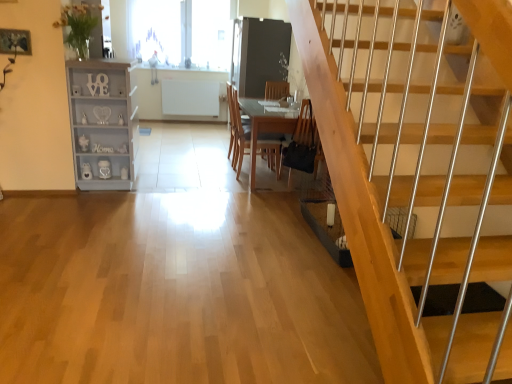
Question: From the image's perspective, is transparent glass window at upper center, the 1th window in the front-to-back sequence, on top of black leather chair at lower center?

Choices:
 (A) no
 (B) yes

Answer: (B)

Question: Does transparent glass window at upper center, which ranks as the second window in back-to-front order, have a smaller size compared to black leather chair at lower center?

Choices:
 (A) no
 (B) yes

Answer: (A)

Question: Does transparent glass window at upper center, which ranks as the second window in back-to-front order, have a larger size compared to black leather chair at lower center?

Choices:
 (A) no
 (B) yes

Answer: (B)

Question: Could black leather chair at lower center be considered to be inside transparent glass window at upper center, which ranks as the second window in back-to-front order?

Choices:
 (A) yes
 (B) no

Answer: (B)

Question: Can you confirm if transparent glass window at upper center, the 1th window in the front-to-back sequence, is taller than black leather chair at lower center?

Choices:
 (A) yes
 (B) no

Answer: (A)

Question: Does transparent glass window at upper center, which ranks as the second window in back-to-front order, lie behind black leather chair at lower center?

Choices:
 (A) yes
 (B) no

Answer: (A)

Question: Does transparent glass window at upper center, which ranks as the second window in back-to-front order, have a smaller size compared to matte black glass door at center?

Choices:
 (A) no
 (B) yes

Answer: (B)

Question: Is the depth of transparent glass window at upper center, the 1th window in the front-to-back sequence, less than that of matte black glass door at center?

Choices:
 (A) yes
 (B) no

Answer: (B)

Question: From a real-world perspective, is transparent glass window at upper center, the 1th window in the front-to-back sequence, on matte black glass door at center?

Choices:
 (A) yes
 (B) no

Answer: (A)

Question: Is transparent glass window at upper center, which ranks as the second window in back-to-front order, far away from matte black glass door at center?

Choices:
 (A) yes
 (B) no

Answer: (A)

Question: Does transparent glass window at upper center, which ranks as the second window in back-to-front order, have a greater height compared to matte black glass door at center?

Choices:
 (A) no
 (B) yes

Answer: (A)

Question: Is transparent glass window at upper center, which ranks as the second window in back-to-front order, directly adjacent to matte black glass door at center?

Choices:
 (A) no
 (B) yes

Answer: (A)

Question: From a real-world perspective, does wooden chair at center sit lower than transparent glass window at upper center, the 1th window in the front-to-back sequence?

Choices:
 (A) yes
 (B) no

Answer: (A)